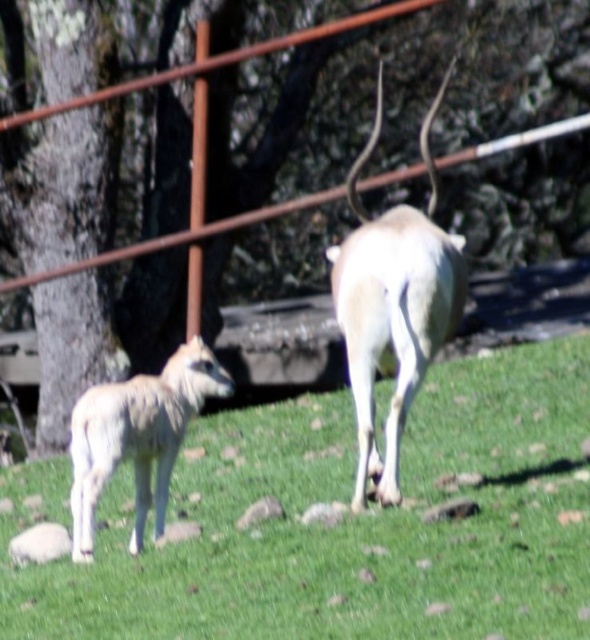
Question: Which object is the farthest from the brown rough tree at upper left?

Choices:
 (A) white woolen lamb at lower left
 (B) green grass at center

Answer: (B)

Question: Is green grass at center behind brown rough tree at upper left?

Choices:
 (A) yes
 (B) no

Answer: (B)

Question: Is white smooth horned deer at center wider than white woolen lamb at lower left?

Choices:
 (A) yes
 (B) no

Answer: (B)

Question: From the image, what is the correct spatial relationship of white smooth horned deer at center in relation to white woolen lamb at lower left?

Choices:
 (A) below
 (B) above

Answer: (B)

Question: Considering the real-world distances, which object is farthest from the brown rough tree at upper left?

Choices:
 (A) white smooth horned deer at center
 (B) white woolen lamb at lower left
 (C) green grass at center

Answer: (C)

Question: Which object appears farthest from the camera in this image?

Choices:
 (A) green grass at center
 (B) white smooth horned deer at center
 (C) brown rough tree at upper left

Answer: (C)